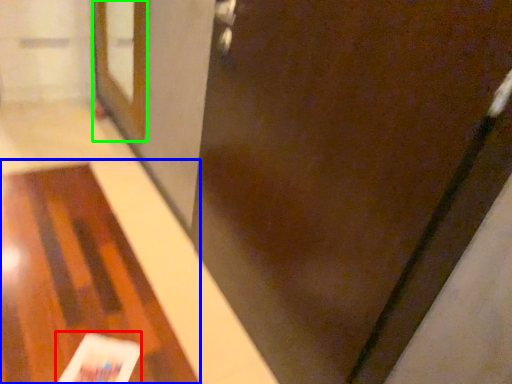
Question: Which object is positioned closest to magazine (highlighted by a red box)? Select from table (highlighted by a blue box) and screen door (highlighted by a green box).

Choices:
 (A) table
 (B) screen door

Answer: (A)